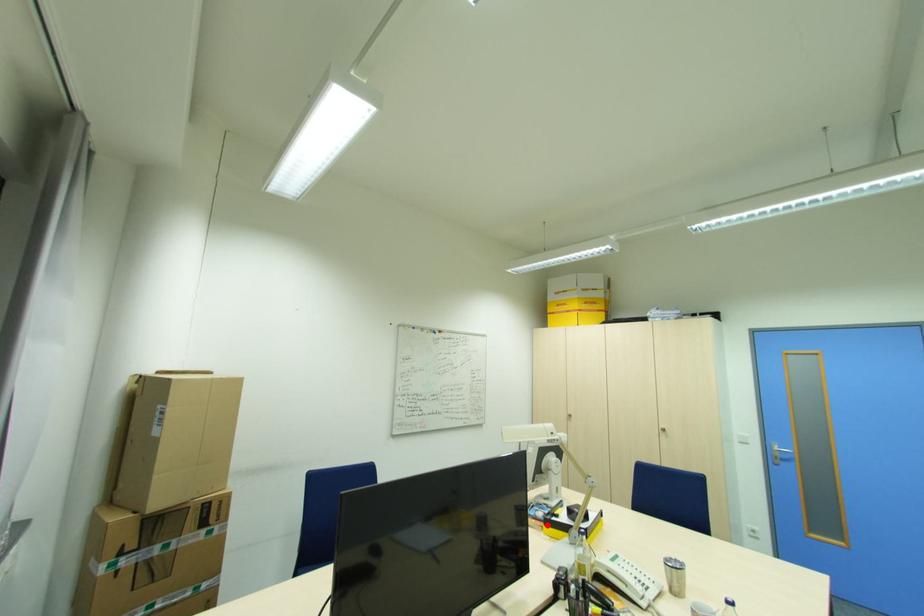
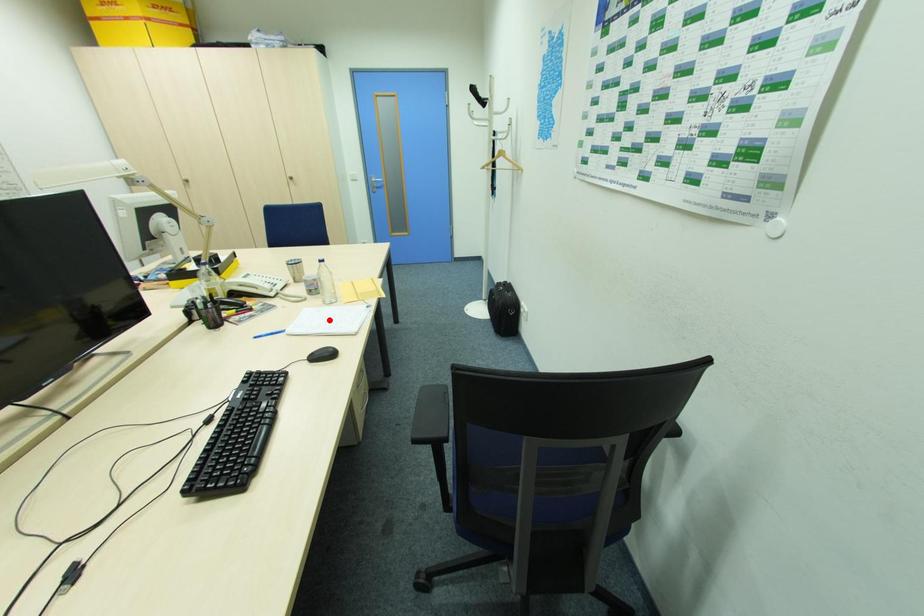
I am providing you with two images of the same scene from different viewpoints. A red point is marked on the first image and another point is marked on the second image. Is the marked point in image1 the same physical position as the marked point in image2?

No